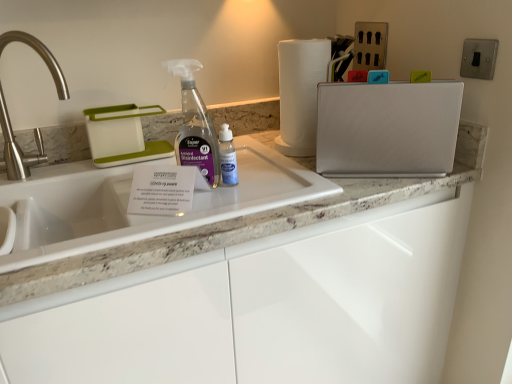
Where is `free space to the left of white plastic dish rack at upper left, the first appliance viewed from the left`? free space to the left of white plastic dish rack at upper left, the first appliance viewed from the left is located at coordinates (54, 167).